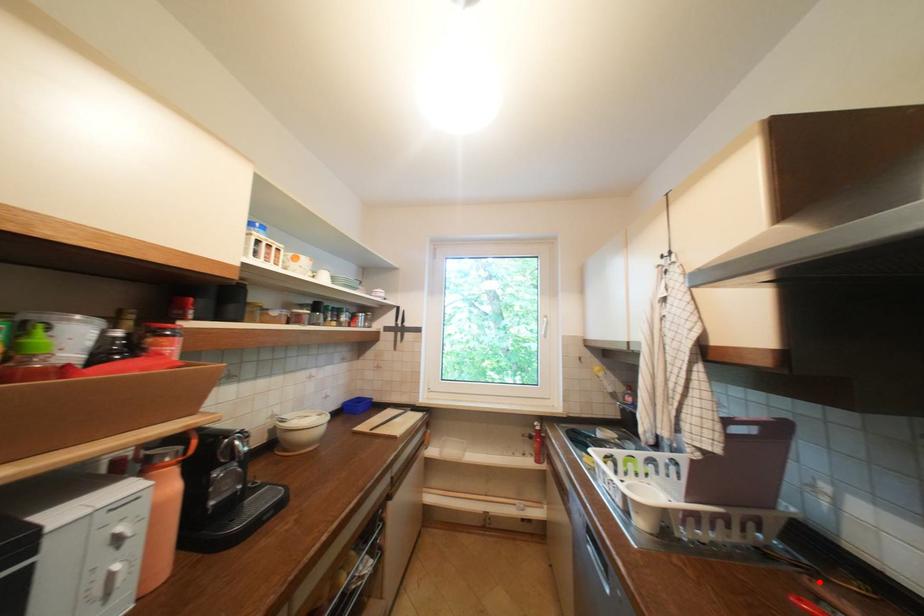
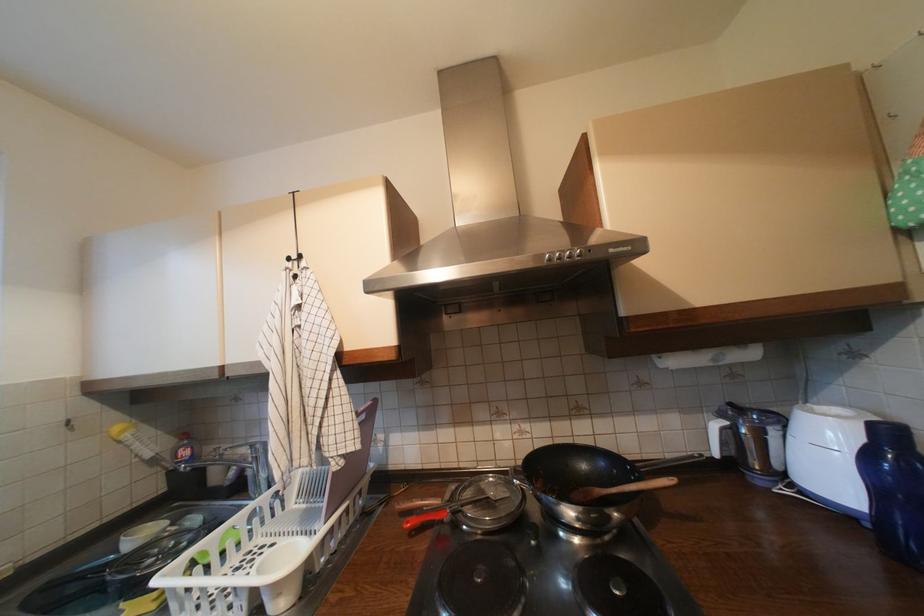
Find the pixel in the second image that matches the highlighted location in the first image.

(407, 506)